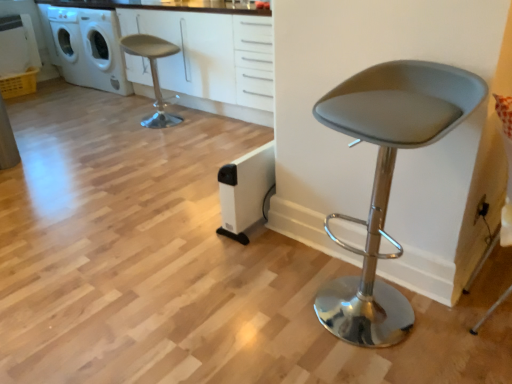
You are a GUI agent. You are given a task and a screenshot of the screen. Output one action in this format:
    pyautogui.click(x=<x>, y=<y>)
    Task: Click on the vacant position to the left of matte gray stool at upper left, positioned as the second chair in bottom-to-top order
    The height and width of the screenshot is (384, 512).
    Given the screenshot: What is the action you would take?
    pyautogui.click(x=115, y=125)